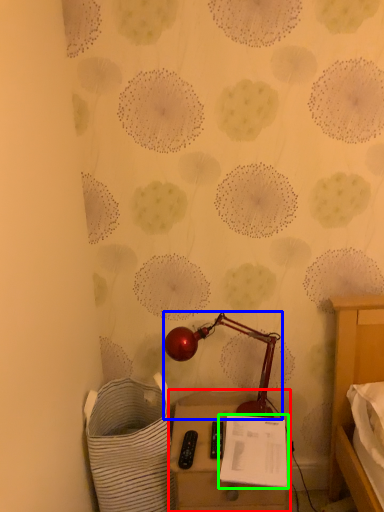
Question: Which is nearer to the furniture (highlighted by a red box)? lamp (highlighted by a blue box) or notepad (highlighted by a green box).

Choices:
 (A) lamp
 (B) notepad

Answer: (B)